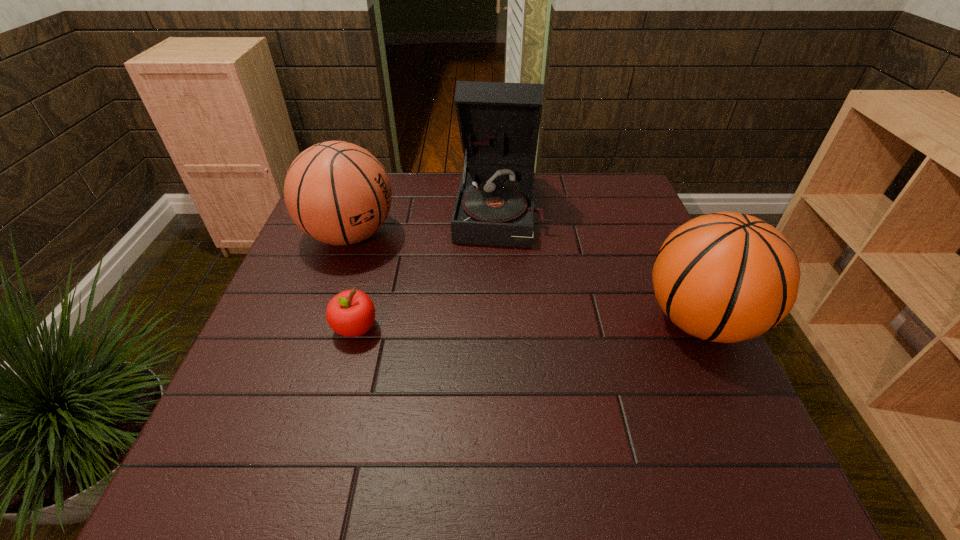
Find the location of a particular element. vacant area situated 0.170m on the front-facing side of the phonograph_record is located at coordinates (493, 293).

Locate an element on the screen. free space located 0.300m on the surface of the farther basketball near the brand logo is located at coordinates (485, 290).

Find the location of a particular element. This screenshot has width=960, height=540. blank space located 0.230m on the surface of the farther basketball near the brand logo is located at coordinates (461, 280).

The image size is (960, 540). Identify the location of free space located on the surface of the farther basketball near the brand logo. (468, 283).

I want to click on phonograph_record located at the far edge, so click(499, 123).

Identify the location of basketball present at the far edge. (338, 193).

You are a GUI agent. You are given a task and a screenshot of the screen. Output one action in this format:
    pyautogui.click(x=<x>, y=<y>)
    Task: Click on the apple at the left edge
    
    Given the screenshot: What is the action you would take?
    pyautogui.click(x=351, y=313)

I want to click on basketball positioned at the left edge, so click(338, 193).

This screenshot has width=960, height=540. I want to click on object that is at the right edge, so click(x=727, y=277).

Where is `object located in the far left corner section of the desktop`? object located in the far left corner section of the desktop is located at coordinates (338, 193).